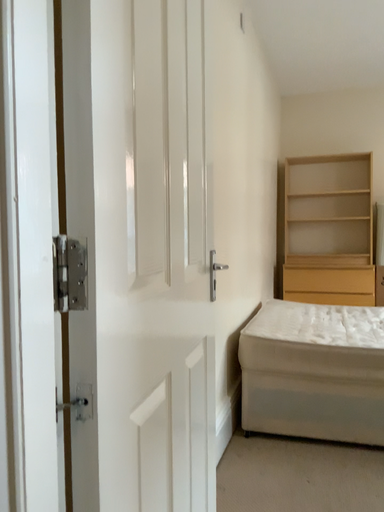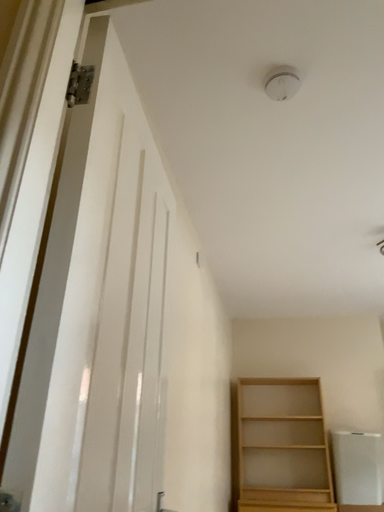
Question: How did the camera likely rotate when shooting the video?

Choices:
 (A) rotated downward
 (B) rotated upward

Answer: (B)